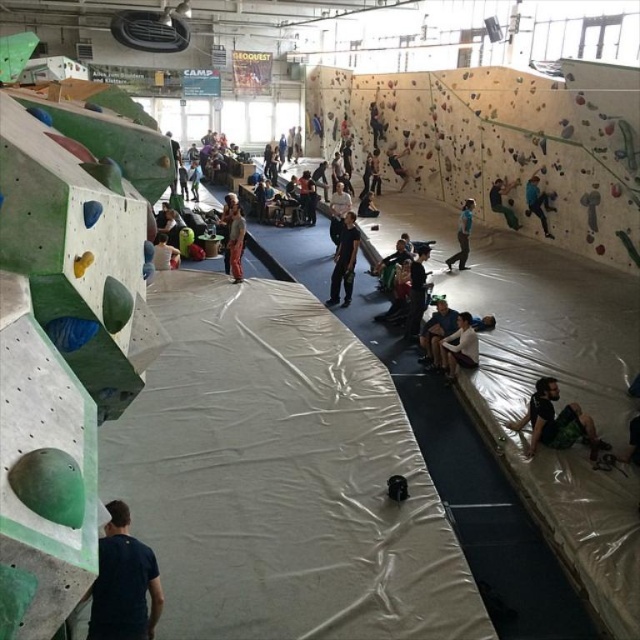
Question: Among these objects, which one is nearest to the camera?

Choices:
 (A) black fabric bag at center
 (B) white fabric at center
 (C) dark blue shirt at center
 (D) dark blue shirt at lower left

Answer: (D)

Question: Which object appears farthest from the camera in this image?

Choices:
 (A) brown fabric pants at center
 (B) green rubber climbing hold at upper right
 (C) green fabric pants at lower right

Answer: (B)

Question: Can you confirm if blue fabric pants at center is positioned to the left of light brown fabric shirt at center?

Choices:
 (A) no
 (B) yes

Answer: (A)

Question: Does dark blue shirt at center appear over brown fabric pants at center?

Choices:
 (A) no
 (B) yes

Answer: (A)

Question: Estimate the real-world distances between objects in this image. Which object is closer to the matte black helmet at upper center?

Choices:
 (A) brown fabric pants at center
 (B) black matte pants at center
 (C) dark blue shirt at lower left
 (D) blue fabric pants at center

Answer: (D)

Question: Can you confirm if green fabric pants at lower right is smaller than light brown fabric shirt at center?

Choices:
 (A) yes
 (B) no

Answer: (A)